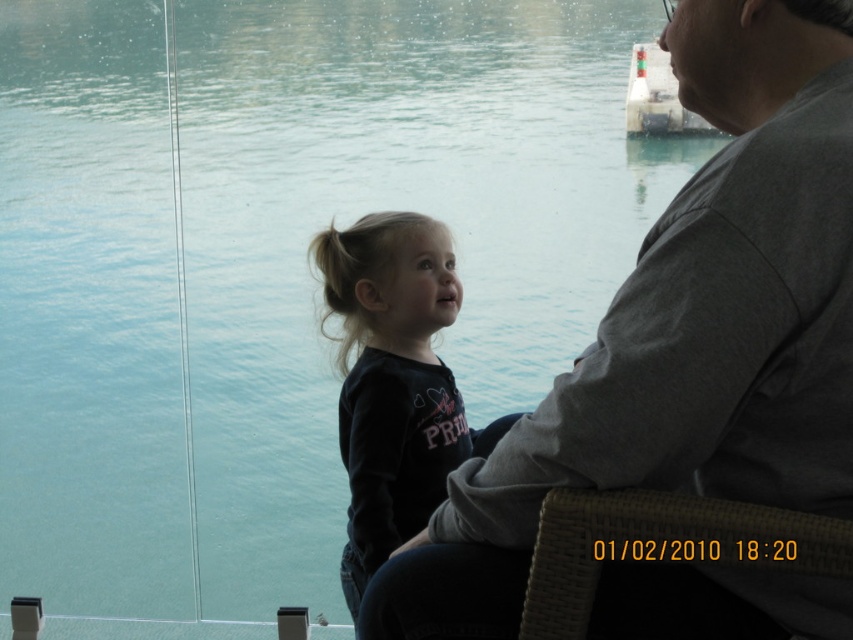
Question: Is gray fabric shirt at upper right smaller than woven brown chair at lower right?

Choices:
 (A) yes
 (B) no

Answer: (B)

Question: Observing the image, what is the correct spatial positioning of gray fabric shirt at upper right in reference to black matte shirt at center?

Choices:
 (A) below
 (B) above

Answer: (B)

Question: Which point is farther to the camera?

Choices:
 (A) green striped buoy at upper right
 (B) gray fabric shirt at upper right

Answer: (A)

Question: Which object is positioned closest to the green striped buoy at upper right?

Choices:
 (A) black matte shirt at center
 (B) gray fabric shirt at upper right

Answer: (A)

Question: Which is nearer to the gray fabric shirt at upper right?

Choices:
 (A) woven brown chair at lower right
 (B) black matte shirt at center
 (C) green striped buoy at upper right

Answer: (A)

Question: Does black matte shirt at center appear on the right side of woven brown chair at lower right?

Choices:
 (A) no
 (B) yes

Answer: (A)